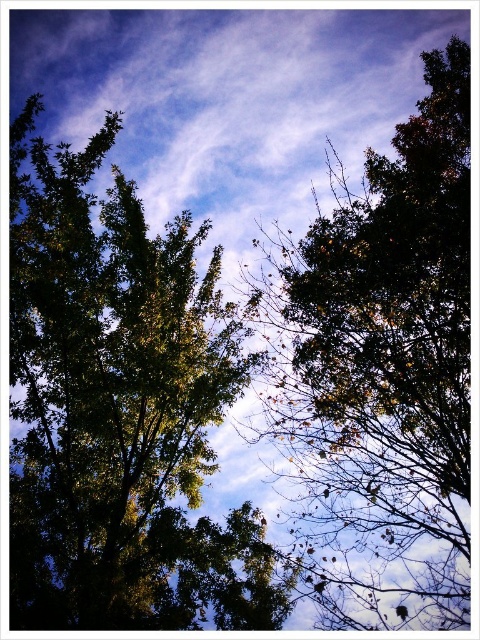
You are an ornithologist observing birds in the forest. You notice two trees in your viewfinder. The green leafy tree at center and the dark green leafy tree at upper center. Which tree would be more suitable for nesting based on their sizes?

The dark green leafy tree at upper center is larger than the green leafy tree at center, making it more suitable for nesting due to its greater size providing more space and stability.

You are standing below looking up at the two trees. Which tree is closer to you, the green leafy tree at center or the dark green leafy tree at upper center?

The green leafy tree at center is closer to you because the dark green leafy tree at upper center is positioned behind it.

You are standing at the base of the green leafy tree at center and want to throw a ball to reach the dark green leafy tree at upper center. The ball can travel 5 meters. Will it reach?

The green leafy tree at center is 4.42 meters from the dark green leafy tree at upper center. Since the ball can travel 5 meters, which is farther than the distance between them, the ball will reach.